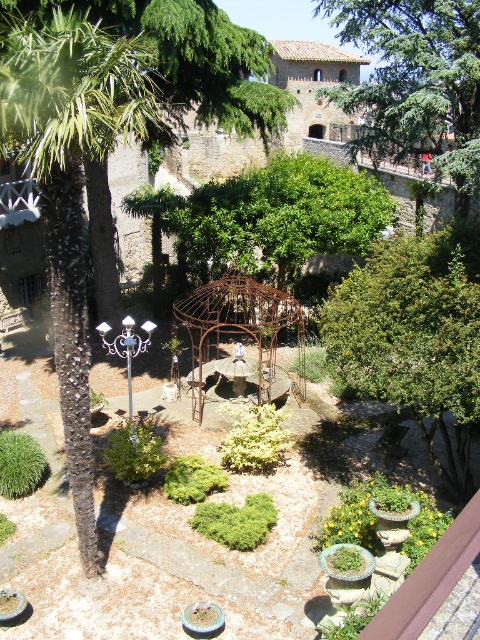
You are a gardener who needs to water the green leafy tree at center and the rusty metal gazebo at center. Since the gazebo has a water feature, you decide to first water the object that is closer to the ground. Which object should you attend to first?

The green leafy tree at center is located below the rusty metal gazebo at center, so the tree is closer to the ground. Therefore, you should water the green leafy tree at center first.

You are planning to take a photo of the garden scene. You want to ensure both the green leafy tree at upper center and the rusty metal gazebo at center are clearly visible in the frame. Based on their sizes, which object might require you to adjust your camera angle to include its full width?

The green leafy tree at upper center has a larger width than the rusty metal gazebo at center, so you might need to adjust your camera angle to include its full width.